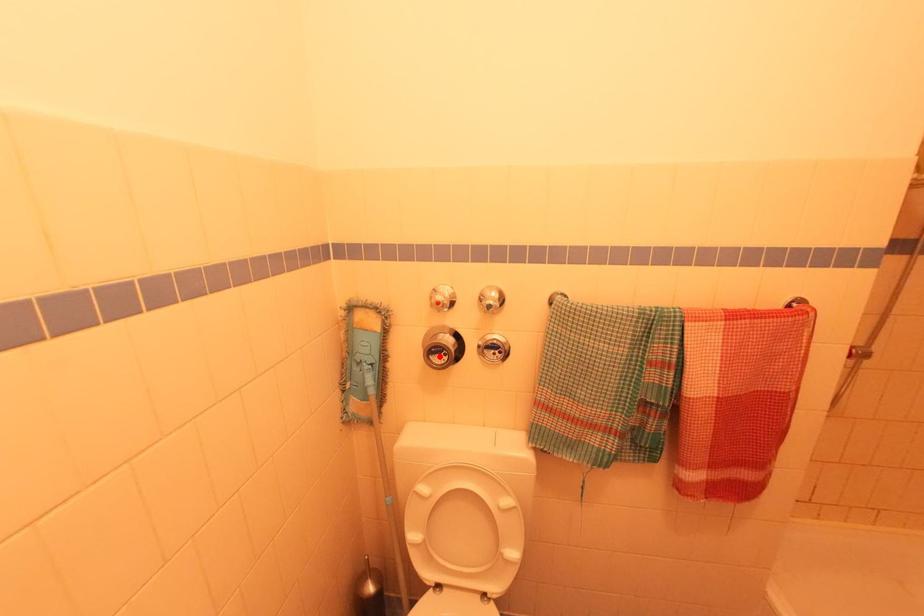
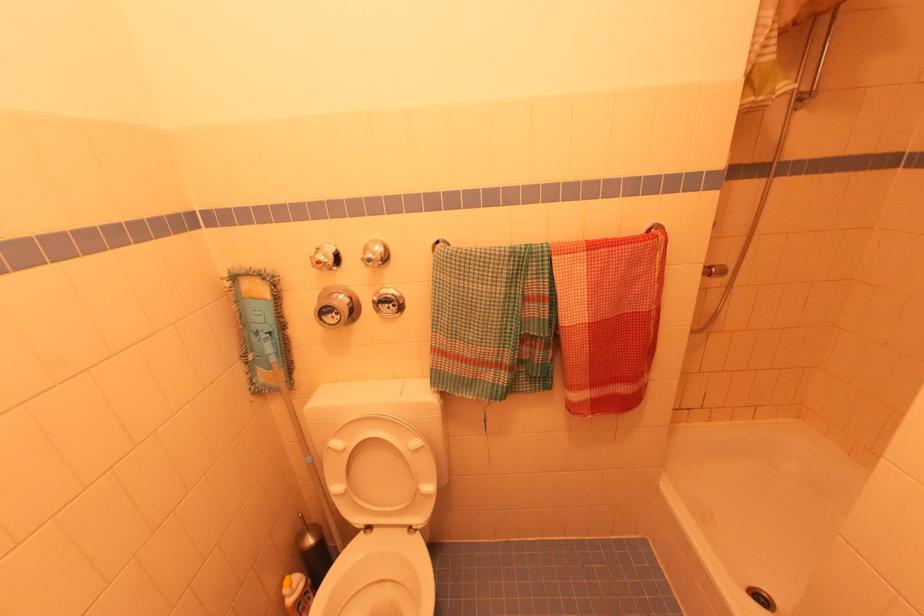
Where in the second image is the point corresponding to the highlighted location from the first image?

(332, 315)